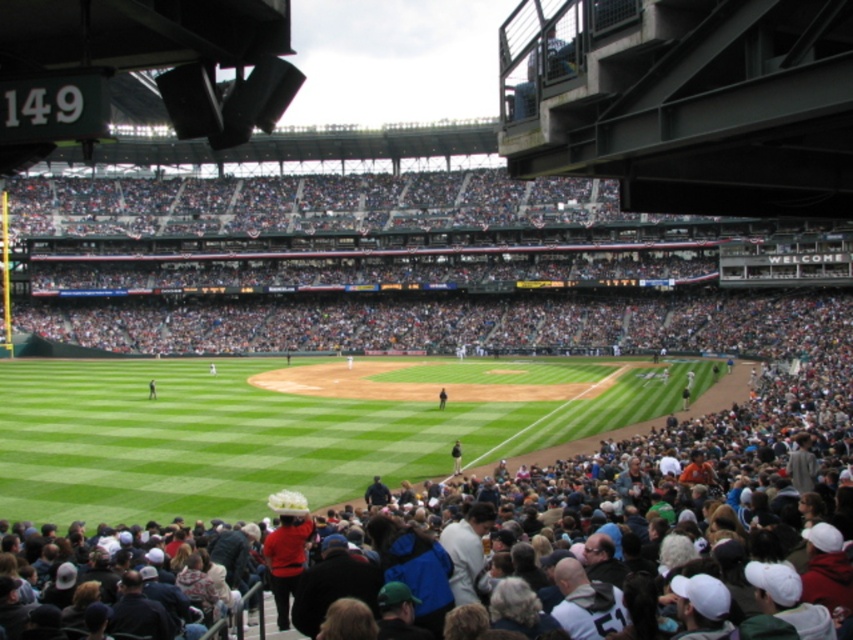
Question: Is dark blue jacket at center further to the viewer compared to dark blue uniform at center?

Choices:
 (A) no
 (B) yes

Answer: (A)

Question: Is dark blue jacket at center to the left of dark blue jersey at center from the viewer's perspective?

Choices:
 (A) no
 (B) yes

Answer: (A)

Question: Where is dark blue uniform at center located in relation to dark blue jersey at center in the image?

Choices:
 (A) below
 (B) above

Answer: (A)

Question: Which point is farther to the camera?

Choices:
 (A) (459, 458)
 (B) (152, 385)
 (C) (444, 403)

Answer: (B)

Question: Which object is positioned farthest from the dark blue uniform at center?

Choices:
 (A) dark blue jacket at center
 (B) dark blue jersey at center

Answer: (B)

Question: Which point appears closest to the camera in this image?

Choices:
 (A) (154, 385)
 (B) (444, 396)

Answer: (B)